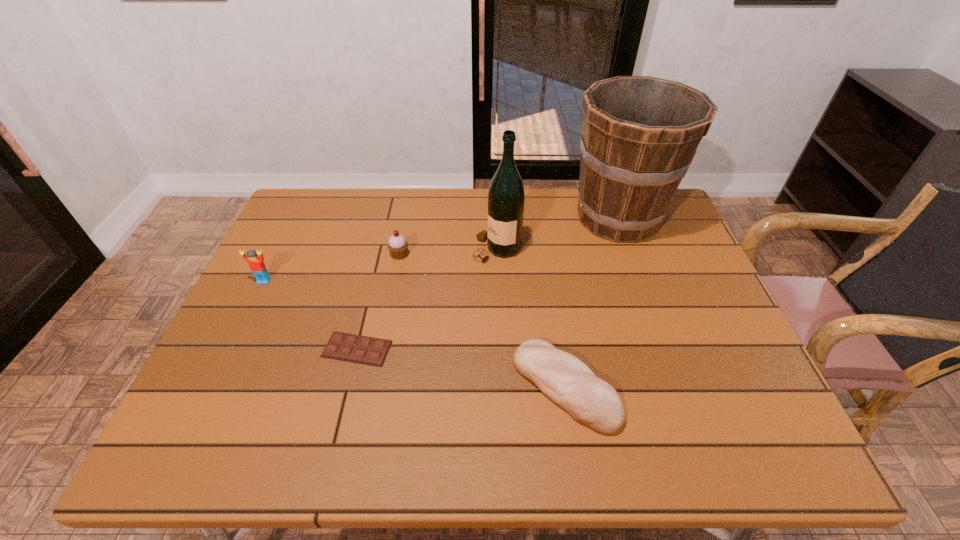
Where is `free space located on the surface of the wine bottle`? The width and height of the screenshot is (960, 540). free space located on the surface of the wine bottle is located at coordinates (452, 249).

In order to click on free space located 0.340m on the face of the fourth shortest object in this screenshot , I will do `click(208, 396)`.

The width and height of the screenshot is (960, 540). I want to click on vacant region located on the right of the fourth tallest object, so click(468, 255).

What are the coordinates of `vacant space located on the right of the second shortest object` in the screenshot? It's located at (702, 387).

Locate an element on the screen. This screenshot has height=540, width=960. free space located on the left of the shortest object is located at coordinates (259, 349).

Locate an element on the screen. The image size is (960, 540). object that is at the far edge is located at coordinates (640, 134).

In order to click on object positioned at the near edge in this screenshot , I will do `click(570, 383)`.

You are a GUI agent. You are given a task and a screenshot of the screen. Output one action in this format:
    pyautogui.click(x=<x>, y=<y>)
    Task: Click on the object positioned at the left edge
    This screenshot has height=540, width=960.
    Given the screenshot: What is the action you would take?
    pyautogui.click(x=256, y=264)

This screenshot has width=960, height=540. What are the coordinates of `object at the right edge` in the screenshot? It's located at (640, 134).

Find the location of a particular element. This screenshot has height=540, width=960. object that is at the far right corner is located at coordinates (640, 134).